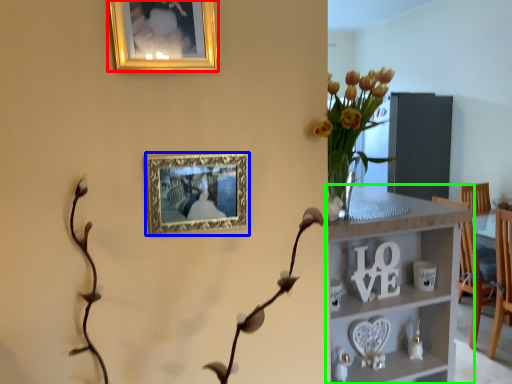
Question: Considering the real-world distances, which object is farthest from picture frame (highlighted by a red box)? picture frame (highlighted by a blue box) or shelf (highlighted by a green box)?

Choices:
 (A) picture frame
 (B) shelf

Answer: (B)